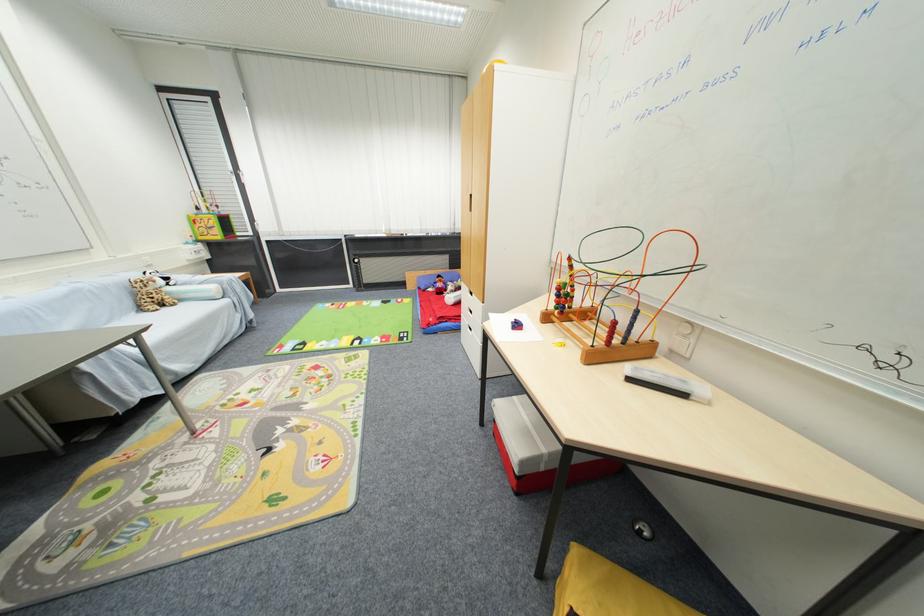
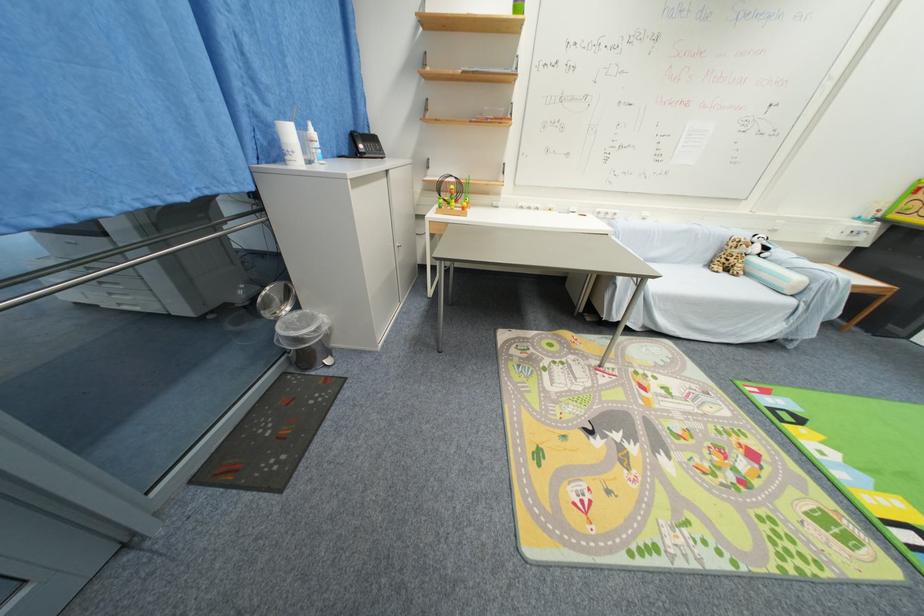
The point at (171, 310) is marked in the first image. Where is the corresponding point in the second image?

(730, 276)